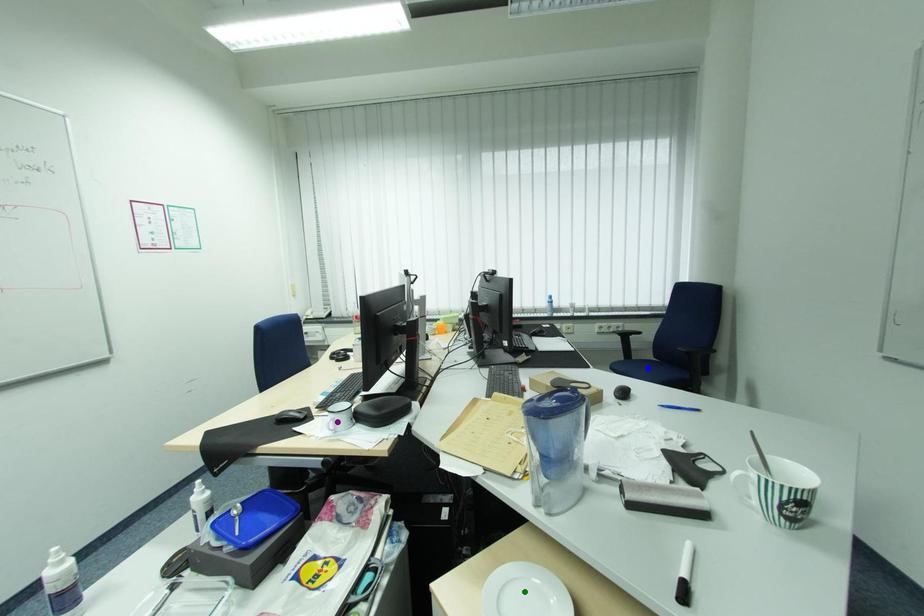
Order these from farthest to nearest:
1. blue point
2. purple point
3. green point

blue point < purple point < green point